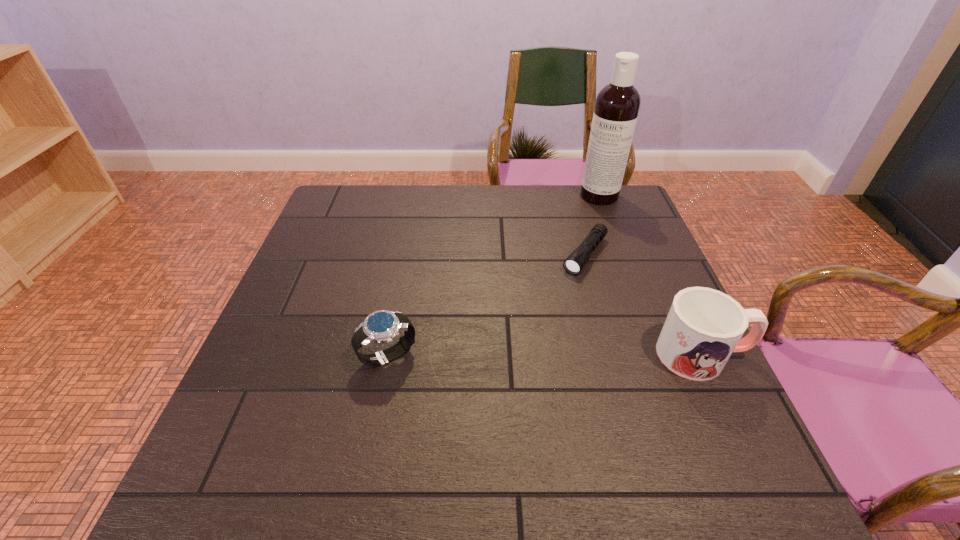
At what (x,y) coordinates should I click in order to perform the action: click on free space that satisfies the following two spatial constraints: 1. on the back side of the leftmost object; 2. on the left side of the dishwasher detergent. Please return your answer as a coordinate pair (x, y). The image size is (960, 540). Looking at the image, I should click on (419, 195).

Find the location of a particular element. vacant space that satisfies the following two spatial constraints: 1. on the front side of the flashlight; 2. on the side of the mug with the handle is located at coordinates (612, 354).

Locate an element on the screen. free space that satisfies the following two spatial constraints: 1. on the front side of the farthest object; 2. on the side of the second tallest object with the handle is located at coordinates (659, 354).